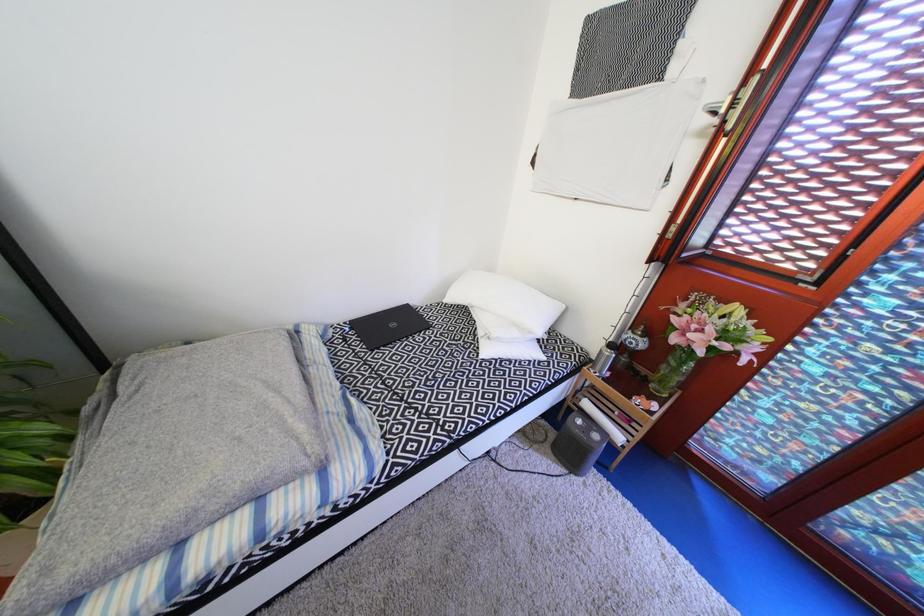
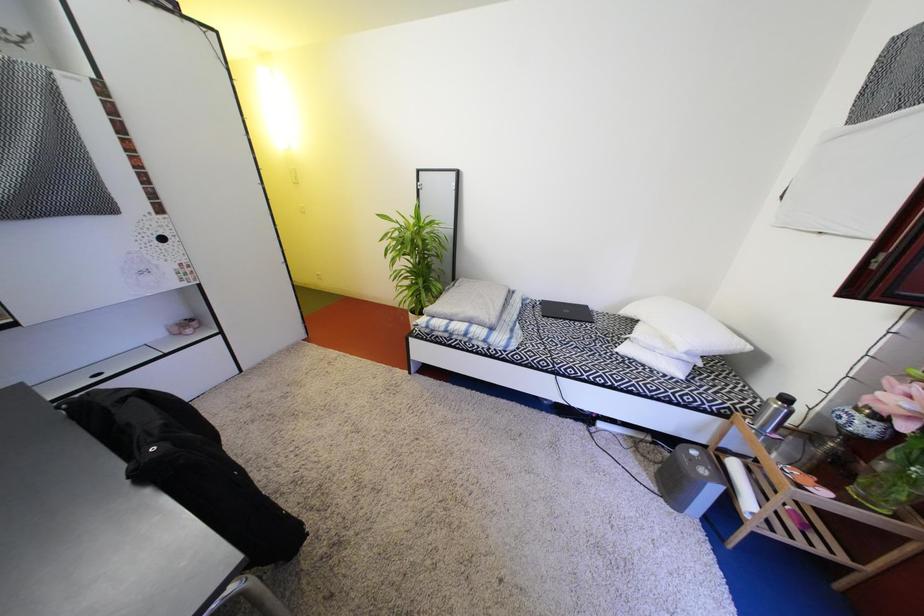
Question: The first image is from the beginning of the video and the second image is from the end. How did the camera likely rotate when shooting the video?

Choices:
 (A) Left
 (B) Right
 (C) Up
 (D) Down

Answer: (A)